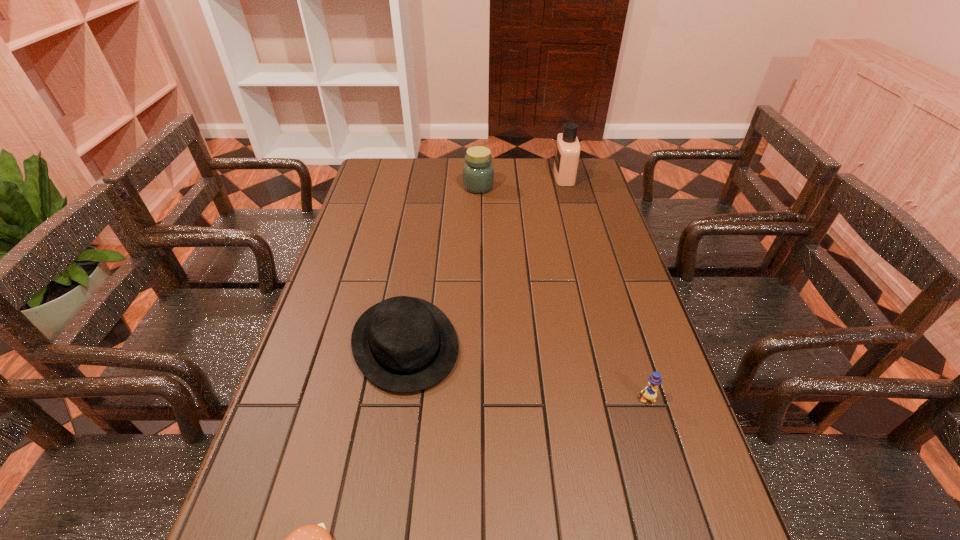
Where is `vacant point located between the duckling and the second tallest object`? vacant point located between the duckling and the second tallest object is located at coordinates (563, 293).

Where is `empty space that is in between the perfume and the fedora`? The image size is (960, 540). empty space that is in between the perfume and the fedora is located at coordinates (485, 260).

Identify the location of empty location between the jar and the fedora. (442, 265).

The image size is (960, 540). Find the location of `empty space that is in between the fourth shortest object and the fedora`. empty space that is in between the fourth shortest object and the fedora is located at coordinates (442, 265).

Where is `free space that is in between the duckling and the fourth shortest object`? The height and width of the screenshot is (540, 960). free space that is in between the duckling and the fourth shortest object is located at coordinates (563, 293).

This screenshot has width=960, height=540. I want to click on vacant region between the fedora and the duckling, so click(x=526, y=371).

Locate an element on the screen. The width and height of the screenshot is (960, 540). vacant area between the second tallest object and the fedora is located at coordinates (442, 265).

Identify which object is the closest to the duckling. Please provide its 2D coordinates. Your answer should be formatted as a tuple, i.e. [(x, y)], where the tuple contains the x and y coordinates of a point satisfying the conditions above.

[(403, 344)]

I want to click on object that stands as the second closest to the jar, so click(x=403, y=344).

Where is `free space that satisfies the following two spatial constraints: 1. on the front label of the tallest object; 2. on the front side of the jar`? free space that satisfies the following two spatial constraints: 1. on the front label of the tallest object; 2. on the front side of the jar is located at coordinates (566, 187).